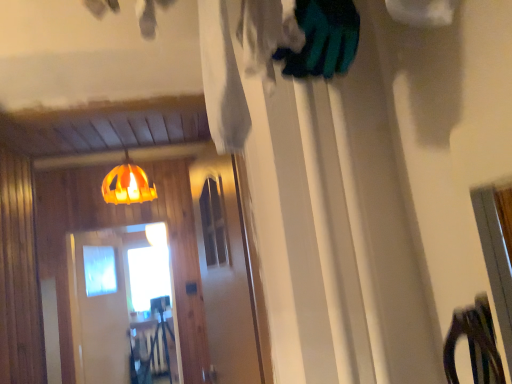
Question: Considering the relative sizes of transparent glass screen door at center, the first screen door in the right-to-left sequence, and transparent plastic screen door at center, which is the 2th screen door in front-to-back order, in the image provided, is transparent glass screen door at center, the first screen door in the right-to-left sequence, smaller than transparent plastic screen door at center, which is the 2th screen door in front-to-back order,?

Choices:
 (A) no
 (B) yes

Answer: (B)

Question: Considering the relative sizes of transparent glass screen door at center, positioned as the 1th screen door in front-to-back order, and transparent plastic screen door at center, which is counted as the 1th screen door, starting from the left, in the image provided, is transparent glass screen door at center, positioned as the 1th screen door in front-to-back order, wider than transparent plastic screen door at center, which is counted as the 1th screen door, starting from the left,?

Choices:
 (A) no
 (B) yes

Answer: (A)

Question: Is transparent glass screen door at center, acting as the second screen door starting from the left, positioned in front of transparent plastic screen door at center, the second screen door positioned from the right?

Choices:
 (A) yes
 (B) no

Answer: (A)

Question: Is transparent glass screen door at center, the first screen door in the right-to-left sequence, turned away from transparent plastic screen door at center, the 1th screen door positioned from the back?

Choices:
 (A) no
 (B) yes

Answer: (A)

Question: Is transparent glass screen door at center, acting as the second screen door starting from the left, located outside transparent plastic screen door at center, the second screen door positioned from the right?

Choices:
 (A) yes
 (B) no

Answer: (A)

Question: From the image's perspective, relative to orange fabric lampshade at upper center, is transparent glass screen door at center, positioned as the 1th screen door in front-to-back order, above or below?

Choices:
 (A) above
 (B) below

Answer: (B)

Question: In terms of width, does transparent glass screen door at center, acting as the second screen door starting from the left, look wider or thinner when compared to orange fabric lampshade at upper center?

Choices:
 (A) thin
 (B) wide

Answer: (A)

Question: Looking at the image, does transparent glass screen door at center, positioned as the 1th screen door in front-to-back order, seem bigger or smaller compared to orange fabric lampshade at upper center?

Choices:
 (A) small
 (B) big

Answer: (B)

Question: Do you think transparent glass screen door at center, acting as the second screen door starting from the left, is within orange fabric lampshade at upper center, or outside of it?

Choices:
 (A) inside
 (B) outside

Answer: (B)

Question: From a real-world perspective, is transparent plastic screen door at center, the second screen door positioned from the right, positioned above or below orange fabric lampshade at upper center?

Choices:
 (A) below
 (B) above

Answer: (A)

Question: Based on their sizes in the image, would you say transparent plastic screen door at center, the second screen door positioned from the right, is bigger or smaller than orange fabric lampshade at upper center?

Choices:
 (A) small
 (B) big

Answer: (B)

Question: Is transparent plastic screen door at center, the 1th screen door positioned from the back, to the left or to the right of orange fabric lampshade at upper center in the image?

Choices:
 (A) left
 (B) right

Answer: (A)

Question: Do you think transparent plastic screen door at center, the 1th screen door positioned from the back, is within orange fabric lampshade at upper center, or outside of it?

Choices:
 (A) outside
 (B) inside

Answer: (A)

Question: From the image's perspective, is orange fabric lampshade at upper center above or below transparent glass screen door at center, which is counted as the 2th screen door, starting from the back?

Choices:
 (A) below
 (B) above

Answer: (B)

Question: Does point (121, 195) appear closer or farther from the camera than point (194, 183)?

Choices:
 (A) closer
 (B) farther

Answer: (B)